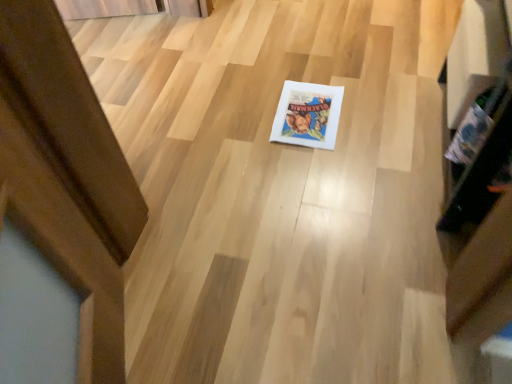
You are a GUI agent. You are given a task and a screenshot of the screen. Output one action in this format:
    pyautogui.click(x=<x>, y=<y>)
    Task: Click on the free space above white paper book at center (from a real-world perspective)
    The image size is (512, 384).
    Given the screenshot: What is the action you would take?
    pyautogui.click(x=309, y=112)